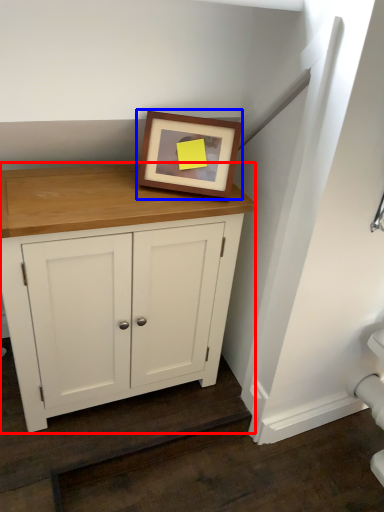
Question: Among these objects, which one is nearest to the camera, cupboard (highlighted by a red box) or picture frame (highlighted by a blue box)?

Choices:
 (A) cupboard
 (B) picture frame

Answer: (A)